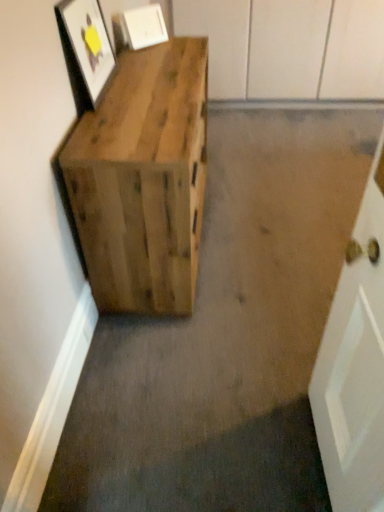
Locate an element on the screen. The image size is (384, 512). vacant region to the right of natural wood crate at left is located at coordinates (272, 207).